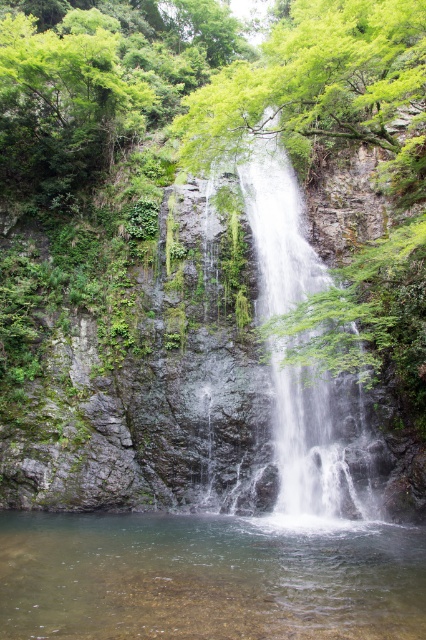
Question: Does clear water at bottom come in front of clear water at center?

Choices:
 (A) yes
 (B) no

Answer: (A)

Question: Which point appears closest to the camera in this image?

Choices:
 (A) (305, 444)
 (B) (288, 541)

Answer: (B)

Question: Is clear water at bottom closer to the viewer compared to clear water at center?

Choices:
 (A) no
 (B) yes

Answer: (B)

Question: Can you confirm if clear water at bottom is positioned to the left of clear water at center?

Choices:
 (A) no
 (B) yes

Answer: (B)